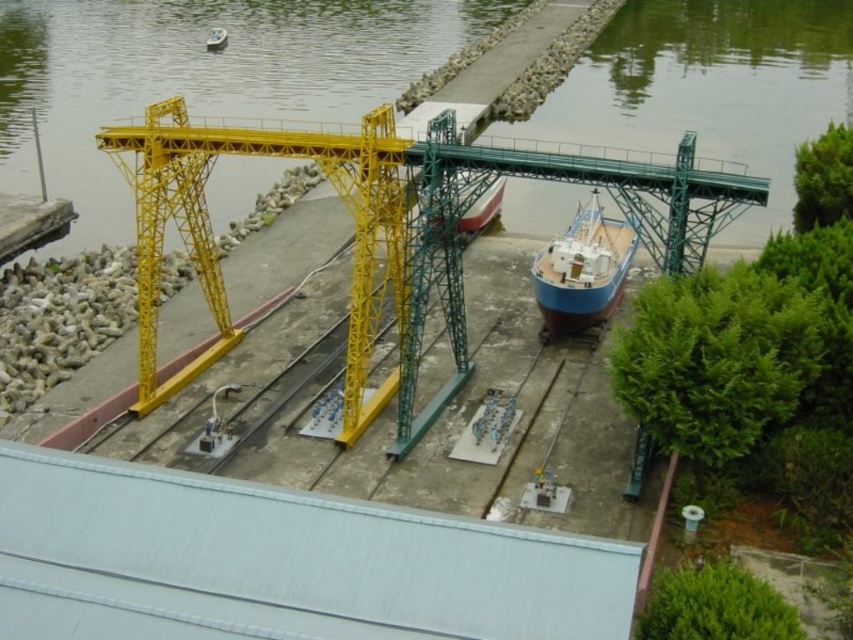
Question: Observing the image, what is the correct spatial positioning of yellow metallic gantry crane at center in reference to yellow metal train track at center?

Choices:
 (A) below
 (B) above

Answer: (B)

Question: Can you confirm if yellow metallic gantry crane at center is smaller than blue matte boat at center?

Choices:
 (A) yes
 (B) no

Answer: (B)

Question: Which object is the closest to the blue matte ship at center?

Choices:
 (A) yellow metal train track at center
 (B) transparent water at upper left
 (C) blue matte boat at center
 (D) yellow metallic gantry crane at center

Answer: (C)

Question: Does transparent water at upper left appear over yellow metallic gantry crane at center?

Choices:
 (A) no
 (B) yes

Answer: (B)

Question: Among these objects, which one is farthest from the camera?

Choices:
 (A) white matte dock at center
 (B) yellow metallic gantry crane at center
 (C) metallic blue boat at center

Answer: (C)

Question: Among these points, which one is farthest from the camera?

Choices:
 (A) (30, 145)
 (B) (480, 204)
 (C) (209, 515)

Answer: (A)